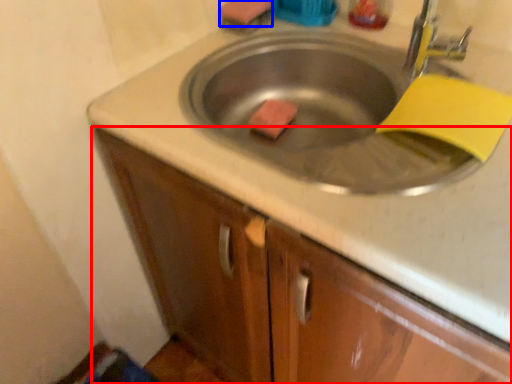
Question: Among these objects, which one is farthest to the camera, cabinetry (highlighted by a red box) or soap (highlighted by a blue box)?

Choices:
 (A) cabinetry
 (B) soap

Answer: (B)